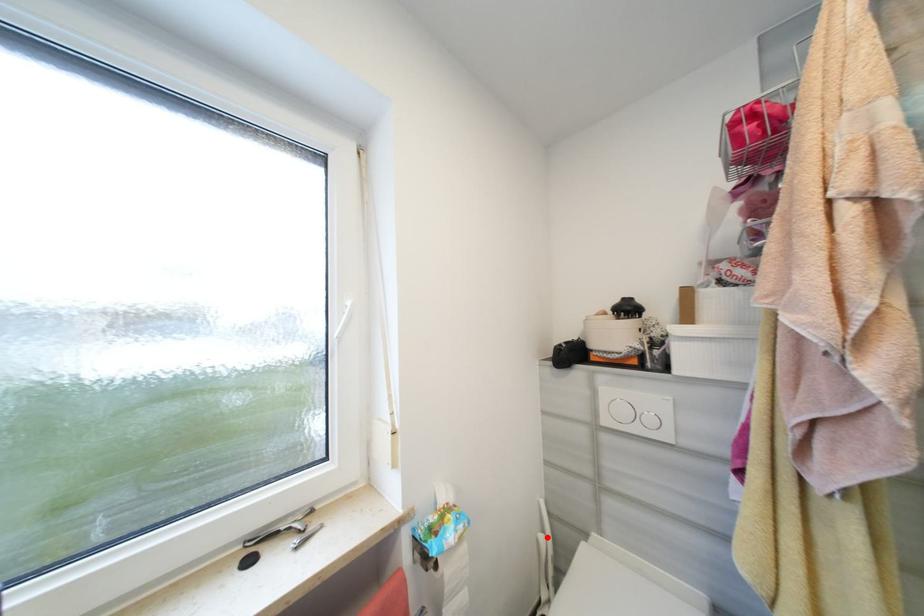
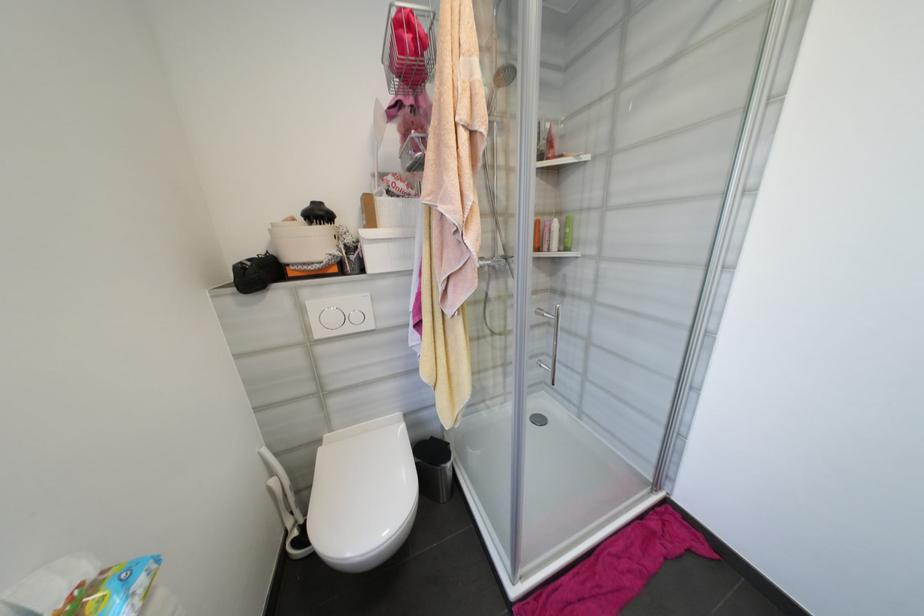
Where in the second image is the point corresponding to the highlighted location from the first image?

(277, 482)